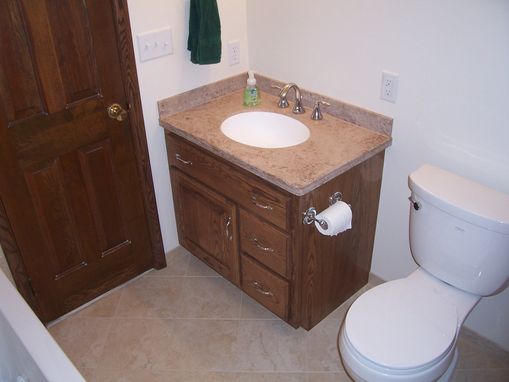
The height and width of the screenshot is (382, 509). Find the location of `closed toilet seat`. closed toilet seat is located at coordinates (384, 333).